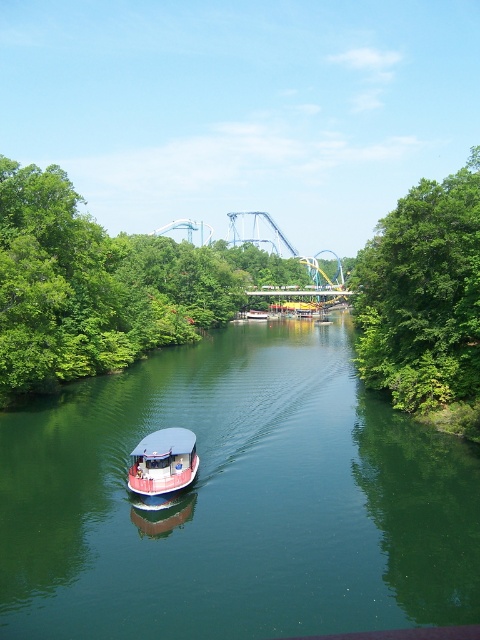
You are standing at the edge of the waterway and want to reach a point marked as point (155,595). If your walking speed is 3 feet per second, how long will it take you to reach that point?

The distance between you and point (155,595) is 50.41 feet. At a walking speed of 3 feet per second, it would take approximately 16.8 seconds to reach the point.

You are a park ranger standing at the edge of the waterway. You need to check the distance between the green leafy tree at right and the white glossy boat at center. Can you confirm if the distance is more than 60 meters?

The green leafy tree at right is 66.02 meters away from the white glossy boat at center, so yes, the distance is more than 60 meters.